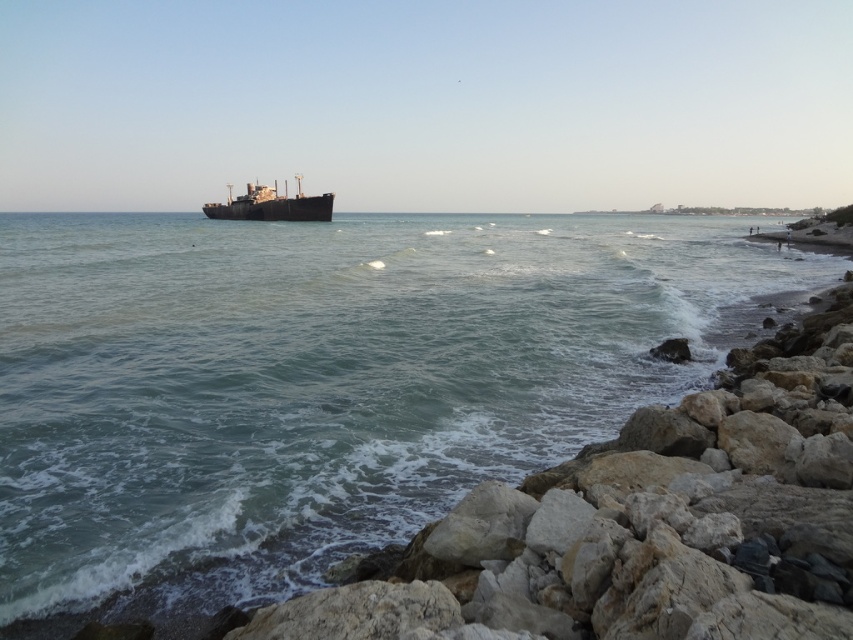
Question: Is greenish-blue water at center further to the viewer compared to rusty metal ship at center?

Choices:
 (A) no
 (B) yes

Answer: (A)

Question: Where is greenish-blue water at center located in relation to rusty metal ship at center in the image?

Choices:
 (A) above
 (B) below

Answer: (B)

Question: Does greenish-blue water at center appear on the right side of rusty metal ship at center?

Choices:
 (A) yes
 (B) no

Answer: (A)